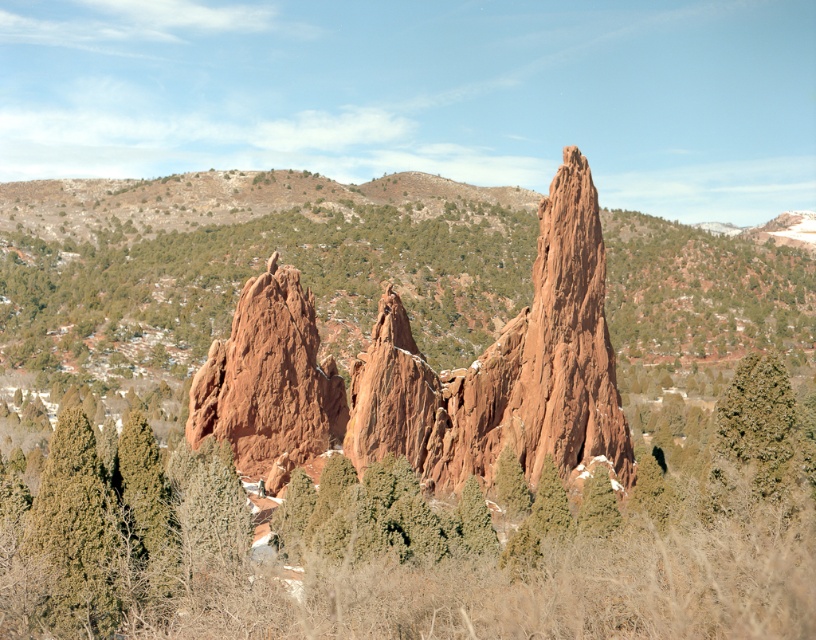
You are standing in the landscape and want to take a photo of both the point at coordinates point (428, 432) and point (795, 410). To ensure both points are in focus, which point should you focus on first?

You should focus on point (428, 432) first because it is closer to the camera than point (795, 410), so adjusting focus from near to far will help both points be in focus.

You are a hiker planning to take a photo of the rustic sandstone rock formation at center and the green textured pine at center. Which object should you focus on first if you want to capture both in a single frame without moving the camera?

You should focus on the rustic sandstone rock formation at center first because it is wider than the green textured pine at center, so positioning it properly will ensure both fit in the frame.

You are planning to take a photo of the rustic sandstone rock formation at center and the green textured pine at center from a position where both are visible. Based on their positions, which object appears closer to the camera?

The rustic sandstone rock formation at center is positioned over the green textured pine at center, so it appears closer to the camera.